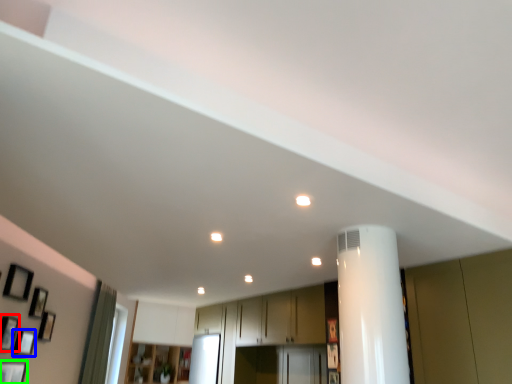
Question: Which is nearer to the picture frame (highlighted by a red box)? picture frame (highlighted by a blue box) or picture frame (highlighted by a green box).

Choices:
 (A) picture frame
 (B) picture frame

Answer: (A)